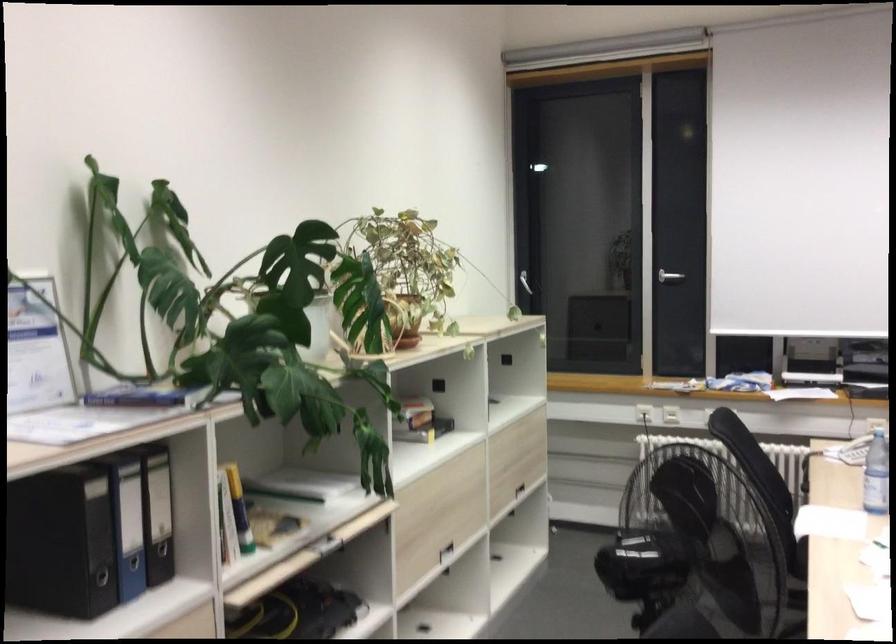
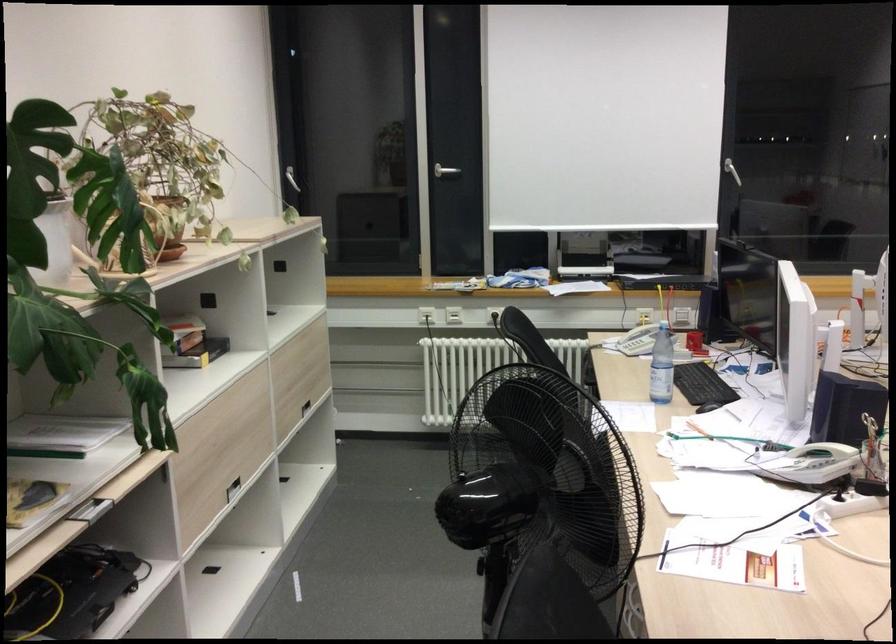
Locate, in the second image, the point that corresponds to point 513,458 in the first image.

(298, 375)